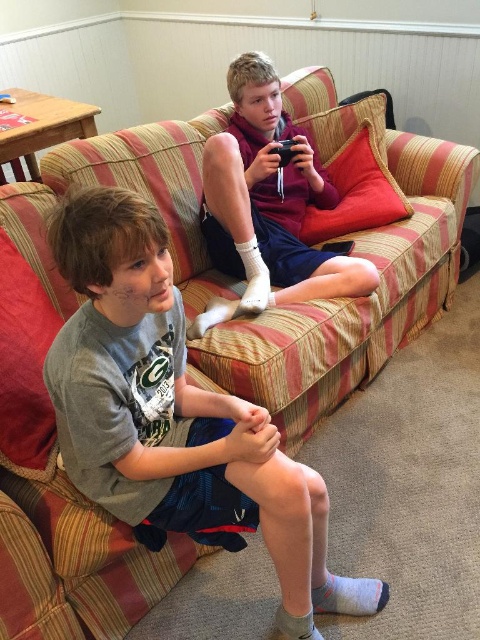
Question: Does matte purple hoodie at upper center have a greater width compared to gray/soft cotton sock at lower center?

Choices:
 (A) no
 (B) yes

Answer: (B)

Question: Which of the following is the farthest from the observer?

Choices:
 (A) matte purple hoodie at upper center
 (B) gray/soft cotton sock at lower center
 (C) gray cotton shirt at lower left
 (D) gray cotton sock at lower center

Answer: (A)

Question: Which is farther from the white soft sock at center?

Choices:
 (A) gray/soft cotton sock at lower center
 (B) gray cotton sock at lower center

Answer: (B)

Question: Among these objects, which one is nearest to the camera?

Choices:
 (A) matte purple hoodie at upper center
 (B) white soft sock at center

Answer: (A)

Question: Is gray cotton shirt at lower left wider than white soft sock at center?

Choices:
 (A) yes
 (B) no

Answer: (A)

Question: Can you confirm if gray/soft cotton sock at lower center is positioned below gray cotton sock at lower center?

Choices:
 (A) yes
 (B) no

Answer: (B)